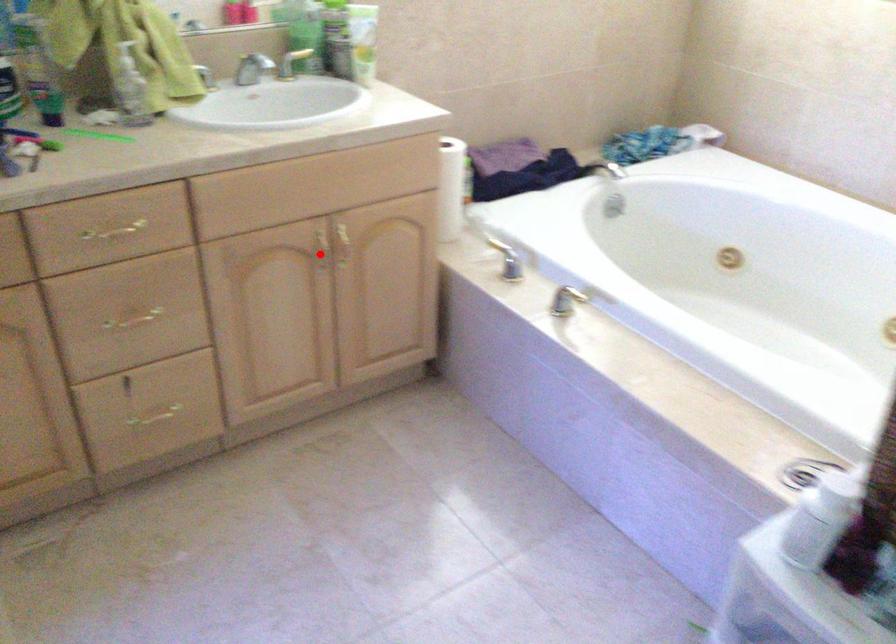
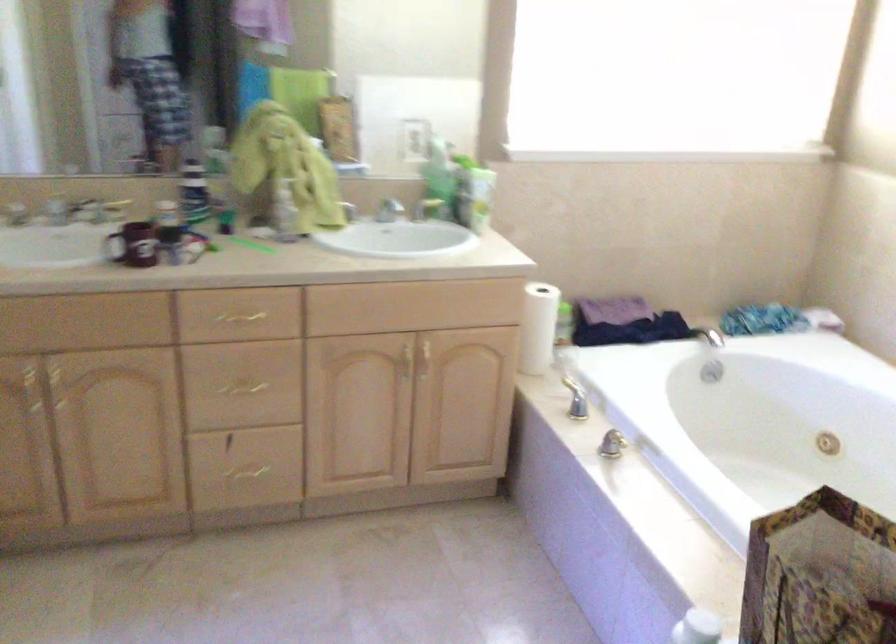
Question: I am providing you with two images of the same scene from different viewpoints. In image1, a red point is highlighted. Considering the same 3D point in image2, which of the following is correct?

Choices:
 (A) It is closer
 (B) It is farther

Answer: (B)